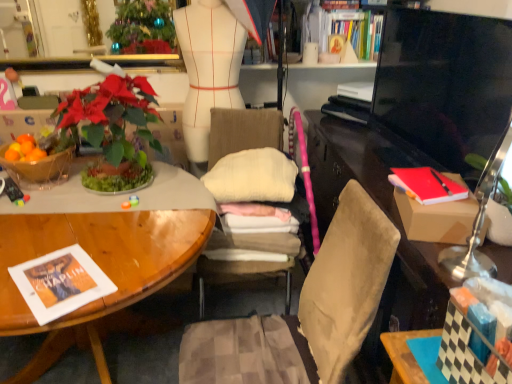
Where is `translucent glass bowl at left`? The image size is (512, 384). translucent glass bowl at left is located at coordinates (39, 169).

What is the approximate height of checkered paper book at lower right, which ranks as the third book in top-to-bottom order?

checkered paper book at lower right, which ranks as the third book in top-to-bottom order, is 7.55 inches in height.

The width and height of the screenshot is (512, 384). What do you see at coordinates (66, 38) in the screenshot?
I see `metallic gold mirror at upper center` at bounding box center [66, 38].

Describe the element at coordinates (243, 131) in the screenshot. I see `beige fabric chair at center` at that location.

You are a GUI agent. You are given a task and a screenshot of the screen. Output one action in this format:
    pyautogui.click(x=<x>, y=<y>)
    Task: Click on the green leafy plant at left
    This screenshot has height=384, width=512.
    Given the screenshot: What is the action you would take?
    pyautogui.click(x=113, y=129)

Looking at this image, is red matte book at right in front of red cardboard box at right?

No, the depth of red matte book at right is greater than that of red cardboard box at right.

From the image's perspective, does red matte book at right appear lower than red cardboard box at right?

Incorrect, from the image's perspective, red matte book at right is higher than red cardboard box at right.

Considering the sizes of red matte book at right and red cardboard box at right in the image, is red matte book at right wider or thinner than red cardboard box at right?

In the image, red matte book at right appears to be more narrow than red cardboard box at right.

Considering the relative positions of red matte book at right and red cardboard box at right in the image provided, is red matte book at right to the left or to the right of red cardboard box at right?

Clearly, red matte book at right is on the left of red cardboard box at right in the image.

Would you say red cardboard box at right is to the left or to the right of hardcover book at upper center, marked as the 1th book in a top-to-bottom arrangement, in the picture?

Clearly, red cardboard box at right is on the left of hardcover book at upper center, marked as the 1th book in a top-to-bottom arrangement, in the image.

What's the angular difference between red cardboard box at right and hardcover book at upper center, marked as the 1th book in a top-to-bottom arrangement,'s facing directions?

The angle between the facing direction of red cardboard box at right and the facing direction of hardcover book at upper center, marked as the 1th book in a top-to-bottom arrangement, is 108 degrees.

Starting from the red cardboard box at right, which book is the 2nd one to the right? Please provide its 2D coordinates.

[(343, 29)]

Is beige fabric chair at center thinner than red cardboard box at right?

Incorrect, the width of beige fabric chair at center is not less than that of red cardboard box at right.

I want to click on chair below the red cardboard box at right (from the image's perspective), so click(x=243, y=131).

Which is less distant, (x=287, y=303) or (x=446, y=172)?

Positioned in front is point (x=446, y=172).

Which of these two, beige fabric chair at center or red cardboard box at right, is smaller?

red cardboard box at right.

Who is smaller, hardcover book at upper center, which appears as the second book when viewed from the front, or metallic gold mirror at upper center?

Smaller between the two is metallic gold mirror at upper center.

Which is more to the left, hardcover book at upper center, the third book when ordered from bottom to top, or metallic gold mirror at upper center?

metallic gold mirror at upper center is more to the left.

Considering the sizes of objects hardcover book at upper center, marked as the 1th book in a top-to-bottom arrangement, and metallic gold mirror at upper center in the image provided, who is taller, hardcover book at upper center, marked as the 1th book in a top-to-bottom arrangement, or metallic gold mirror at upper center?

metallic gold mirror at upper center.

How many degrees apart are the facing directions of red matte book at right and metallic gold mirror at upper center?

81.2 degrees.

Does red matte book at right come behind metallic gold mirror at upper center?

No, it is not.

From the image's perspective, is red matte book at right beneath metallic gold mirror at upper center?

Yes.

From a real-world perspective, which book is the 1st one underneath the metallic gold mirror at upper center? Please provide its 2D coordinates.

[(343, 29)]

Does point (24, 66) appear closer or farther from the camera than point (362, 25)?

Clearly, point (24, 66) is closer to the camera than point (362, 25).

Consider the image. Between metallic gold mirror at upper center and hardcover book at upper center, the third book when ordered from bottom to top, which one has more height?

metallic gold mirror at upper center is taller.

Considering the sizes of checkered paper book at lower right, which is counted as the 1th book, starting from the front, and red cardboard box at right in the image, is checkered paper book at lower right, which is counted as the 1th book, starting from the front, taller or shorter than red cardboard box at right?

Clearly, checkered paper book at lower right, which is counted as the 1th book, starting from the front, is taller compared to red cardboard box at right.

Is checkered paper book at lower right, placed as the first book when sorted from bottom to top, aimed at red cardboard box at right?

No, checkered paper book at lower right, placed as the first book when sorted from bottom to top, is not turned towards red cardboard box at right.

Consider the image. Is checkered paper book at lower right, which ranks as the third book in top-to-bottom order, inside or outside of red cardboard box at right?

checkered paper book at lower right, which ranks as the third book in top-to-bottom order, is located beyond the bounds of red cardboard box at right.

What's the angular difference between checkered paper book at lower right, placed as the first book when sorted from bottom to top, and red cardboard box at right's facing directions?

The facing directions of checkered paper book at lower right, placed as the first book when sorted from bottom to top, and red cardboard box at right are 19.6 degrees apart.

Locate an element on the screen. Image resolution: width=512 pixels, height=384 pixels. magazine to the left of red cardboard box at right is located at coordinates (428, 185).

This screenshot has width=512, height=384. In order to click on box below the hardcover book at upper center, marked as the 1th book in a top-to-bottom arrangement (from a real-world perspective) in this screenshot , I will do `click(437, 219)`.

Which object lies nearer to the anchor point black glossy television at right, green leafy plant at left or beige fabric chair at center?

beige fabric chair at center is positioned closer to the anchor black glossy television at right.

From the image, which object appears to be nearer to red matte book at right, matte brown desk at right or red cardboard box at right?

The object closer to red matte book at right is red cardboard box at right.

From the picture: Based on their spatial positions, is beige fabric chair at center or matte brown desk at right further from green leafy plant at left?

matte brown desk at right.

When comparing their distances from hardcover book at upper center, which appears as the second book when viewed from the front, does matte brown desk at right or checkered paper book at lower right, which ranks as the third book in top-to-bottom order, seem further?

checkered paper book at lower right, which ranks as the third book in top-to-bottom order.

Considering their positions, is red cardboard box at right positioned further to white matte mannequin at center than black glossy television at right?

Among the two, red cardboard box at right is located further to white matte mannequin at center.

From the image, which object appears to be farther from translucent glass bowl at left, matte brown desk at right or hardcover book at upper center, the second book in the bottom-to-top sequence?

The object further to translucent glass bowl at left is hardcover book at upper center, the second book in the bottom-to-top sequence.

Based on their spatial positions, is translucent glass bowl at left or checkered paper book at lower right, which ranks as the third book in top-to-bottom order, further from metallic gold mirror at upper center?

Among the two, checkered paper book at lower right, which ranks as the third book in top-to-bottom order, is located further to metallic gold mirror at upper center.

When comparing their distances from black glossy television at right, does hardcover book at upper center, which is the 3th book in front-to-back order, or white matte mannequin at center seem closer?

Among the two, hardcover book at upper center, which is the 3th book in front-to-back order, is located nearer to black glossy television at right.

Image resolution: width=512 pixels, height=384 pixels. In order to click on magazine between white matte mannequin at center and black glossy television at right from left to right in this screenshot , I will do `click(428, 185)`.

Where is `box between black glossy television at right and matte brown desk at right in the up-down direction`? This screenshot has height=384, width=512. box between black glossy television at right and matte brown desk at right in the up-down direction is located at coordinates (437, 219).

The width and height of the screenshot is (512, 384). I want to click on mannequin located between matte brown desk at right and hardcover book at upper center, which is the 3th book in front-to-back order, in the depth direction, so click(208, 70).

The image size is (512, 384). Find the location of `houseplant between metallic gold mirror at upper center and red matte book at right`. houseplant between metallic gold mirror at upper center and red matte book at right is located at coordinates [x=113, y=129].